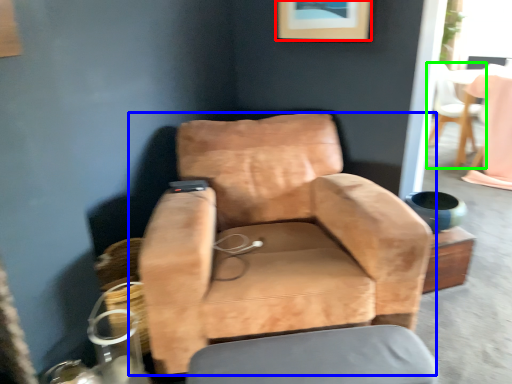
Question: Which is nearer to the picture frame (highlighted by a red box)? chair (highlighted by a blue box) or chair (highlighted by a green box).

Choices:
 (A) chair
 (B) chair

Answer: (A)